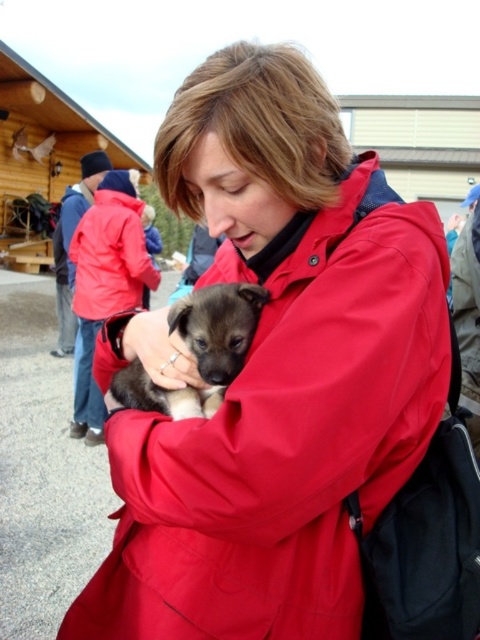
You are a delivery robot that needs to deliver a package to the person wearing the matte red trench coat at center. However, you must avoid getting too close to the brown fur puppy at center. What is the minimum distance you should maintain between the robot and the puppy to safely reach the person?

The minimum distance you should maintain between the robot and the brown fur puppy at center is 28.34 inches. This ensures the robot can safely reach the matte red trench coat at center without getting too close to the puppy.

You are a photographer trying to capture a clear photo of the brown fur puppy at center and the matte red jacket at upper left. If you focus on the puppy first, will the jacket still be in focus?

The brown fur puppy at center has a lesser height compared to matte red jacket at upper left, so focusing on the puppy may not ensure the jacket is in focus due to the difference in their sizes and positions.